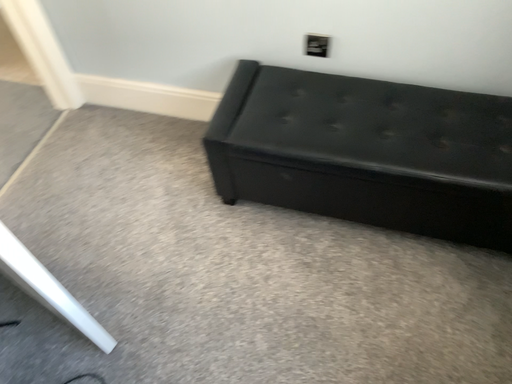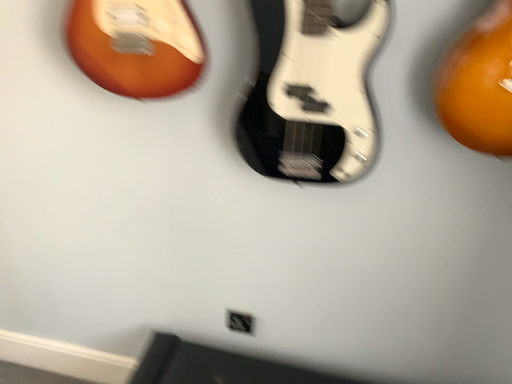
Question: Which way did the camera rotate in the video?

Choices:
 (A) rotated upward
 (B) rotated downward

Answer: (A)